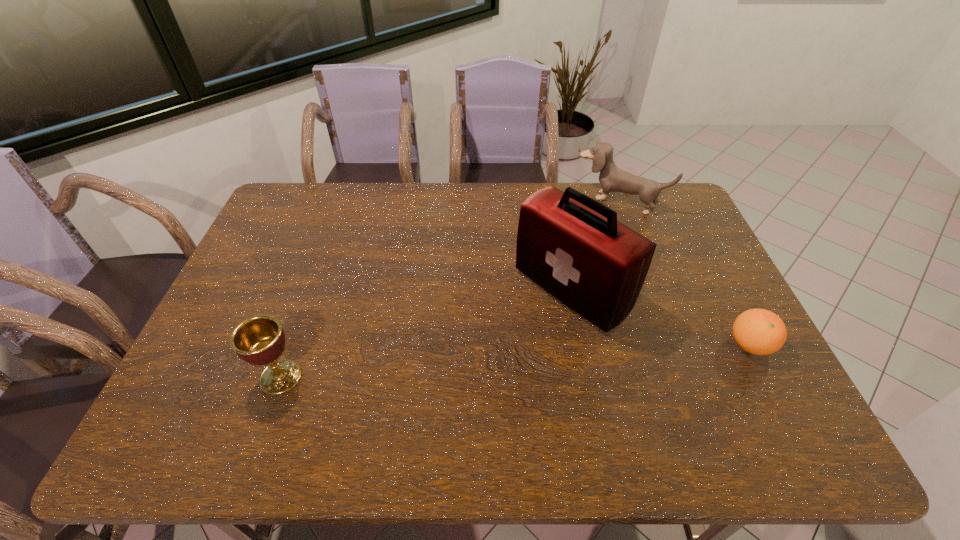
This screenshot has width=960, height=540. Identify the location of free space on the desktop that is between the leftmost object and the shortest object and is positioned on the side of the first aid kit with the cross symbol. (479, 363).

The height and width of the screenshot is (540, 960). What are the coordinates of `free space on the desktop that is between the leftmost object and the orange and is positioned at the face of the puppy` in the screenshot? It's located at tap(516, 361).